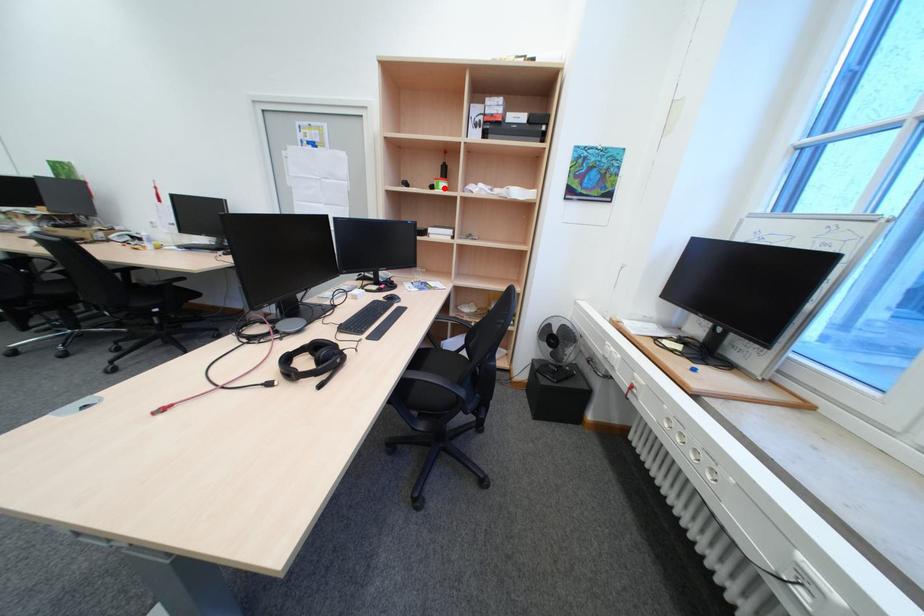
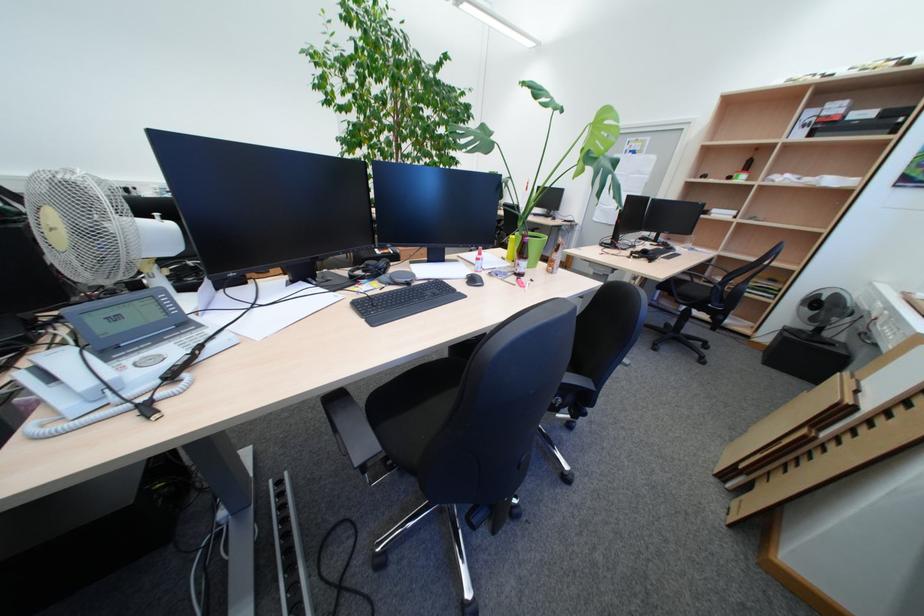
In the second image, find the point that corresponds to the highlighted location in the first image.

(742, 179)